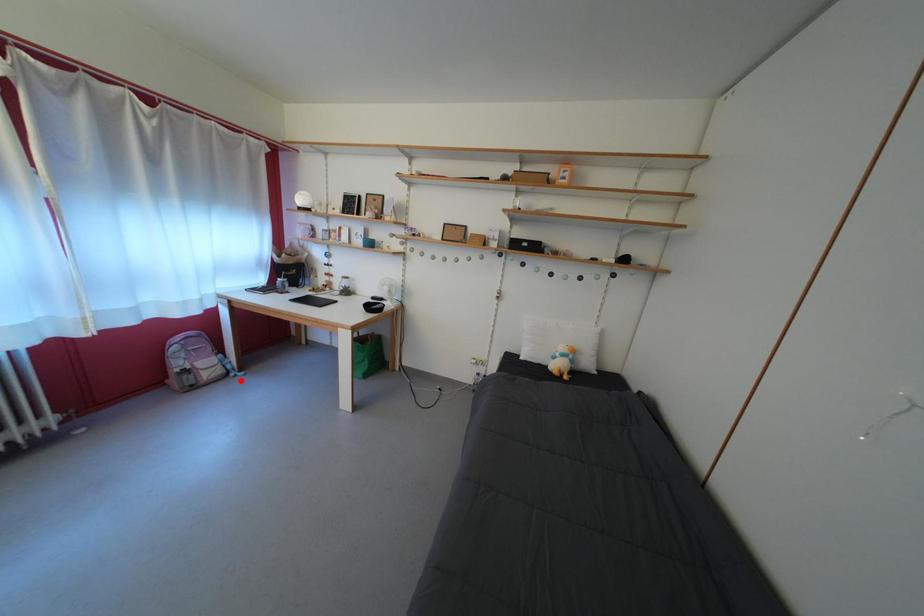
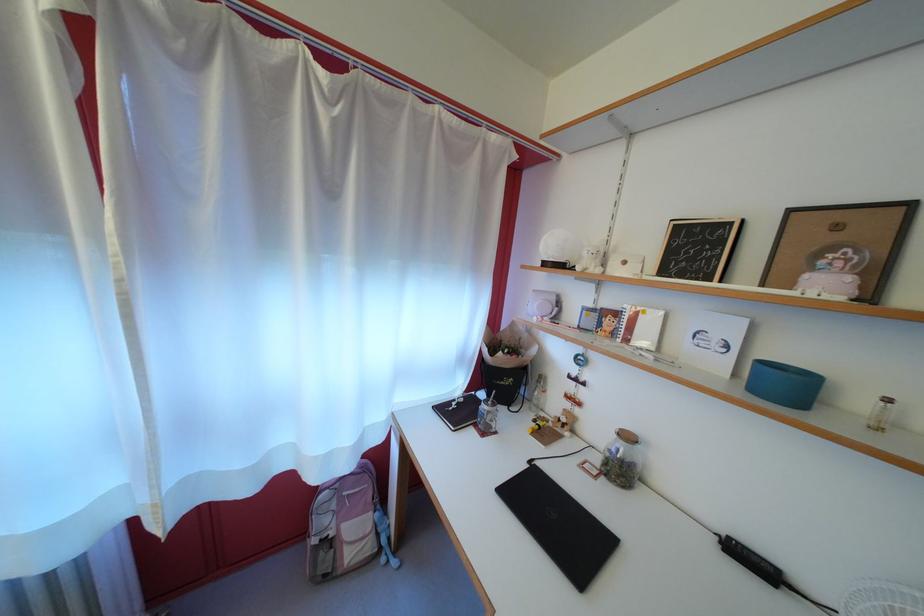
Locate, in the second image, the point that corresponds to the highlighted location in the first image.

(392, 565)